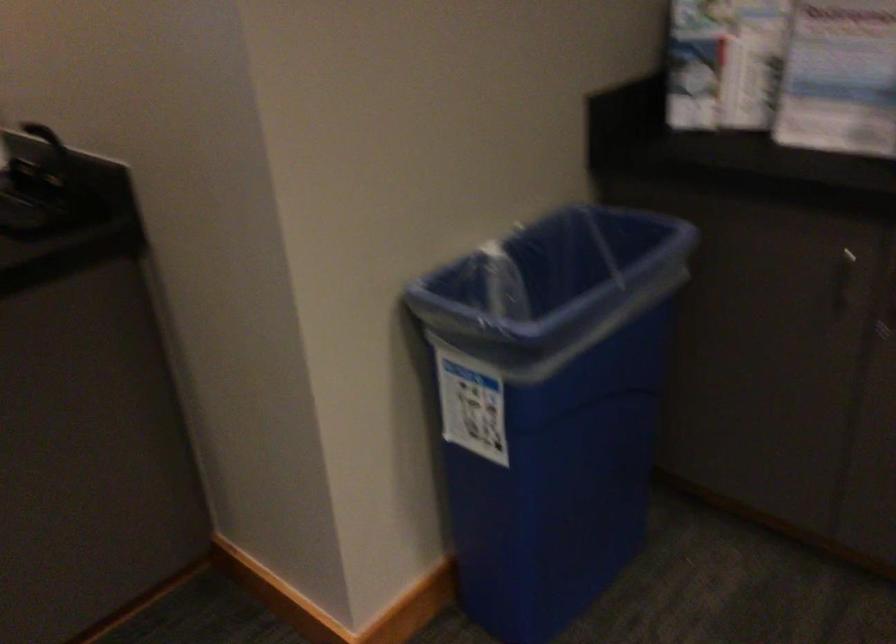
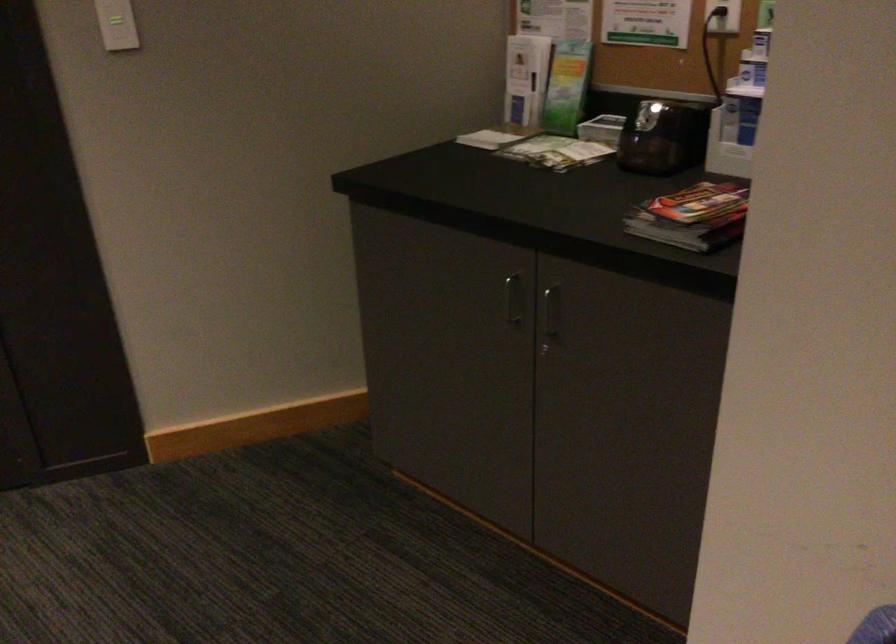
The first image is from the beginning of the video and the second image is from the end. How did the camera likely rotate when shooting the video?

The camera's rotation is toward left-down.